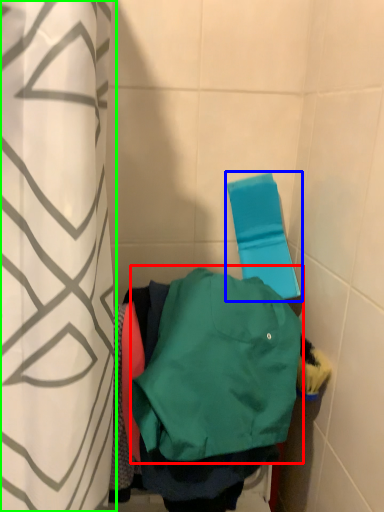
Question: Estimate the real-world distances between objects in this image. Which object is closer to sweatshirt (highlighted by a red box), beach towel (highlighted by a blue box) or curtain (highlighted by a green box)?

Choices:
 (A) beach towel
 (B) curtain

Answer: (B)